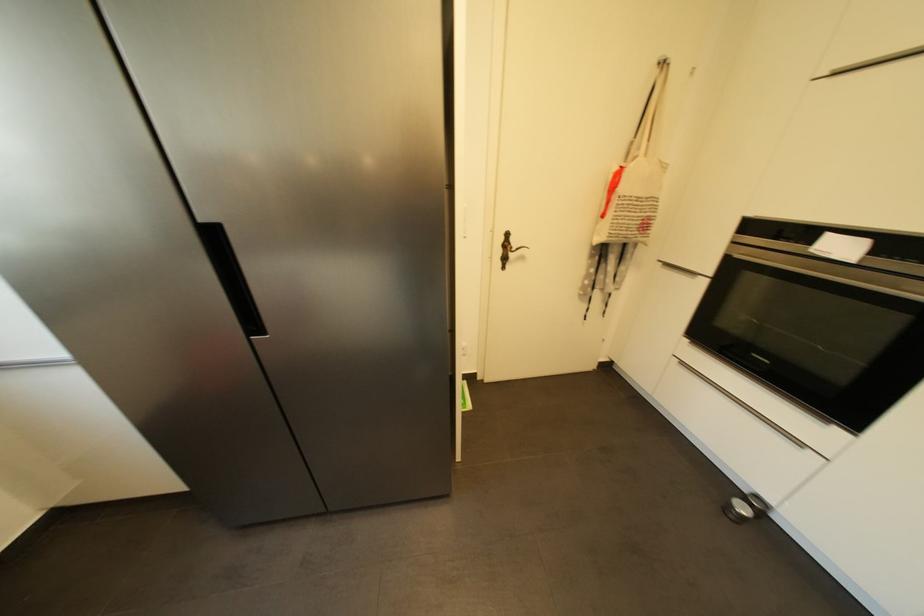
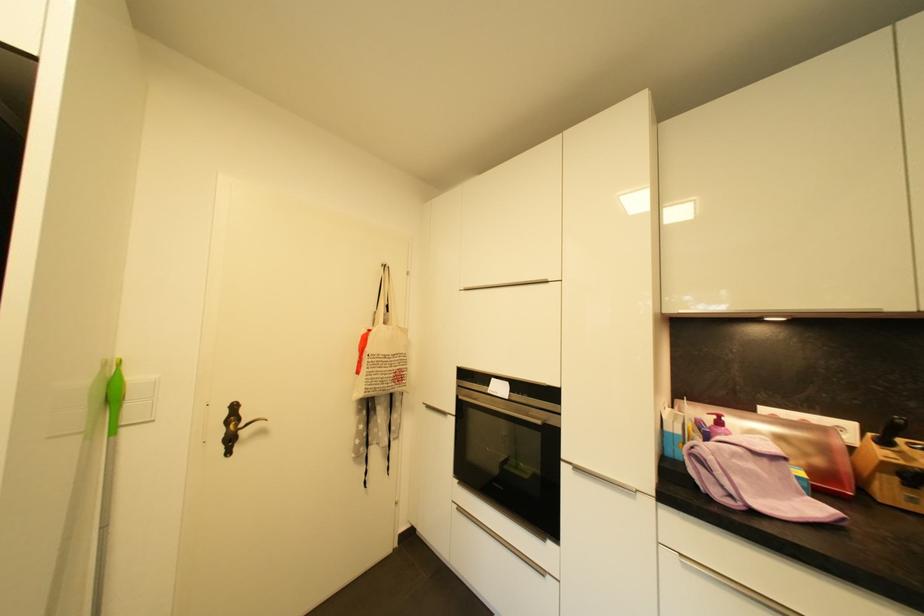
Find the pixel in the second image that matches (x=505, y=254) in the first image.

(225, 434)